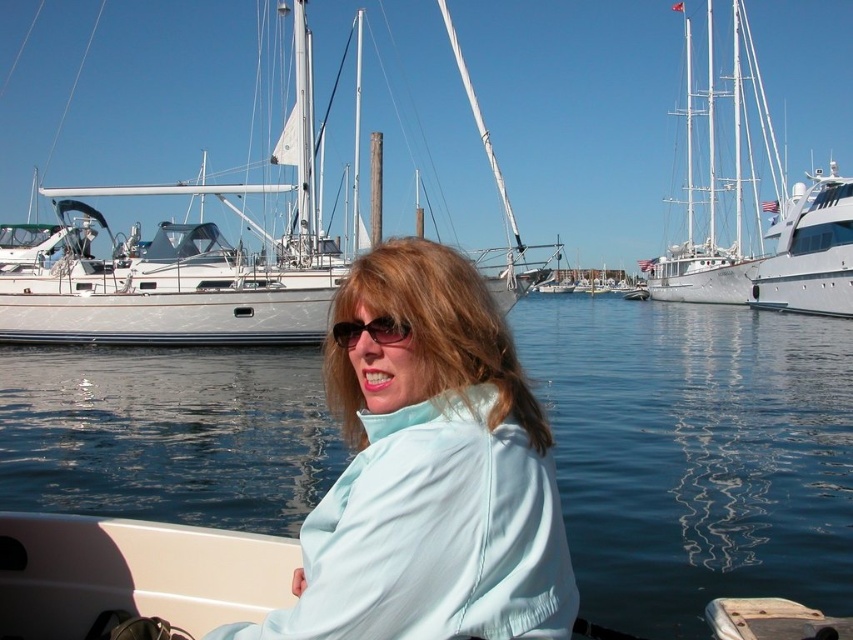
In the scene shown: You are standing at the origin point in the marina scene. There are two points marked in the image. Which point is closer to you, point (0, 330) or point (340, 340)?

Point (340, 340) is closer to you because it is in front of point (0, 330).

You are standing at the edge of the marina and want to reach the point marked as point (294, 316). If your walking speed is 1.5 meters per second, how many seconds will it take you to reach that point?

The distance between you and point (294, 316) is 26.07 meters. At a walking speed of 1.5 meters per second, it will take approximately 17.38 seconds to reach the point.

You are a photographer standing at the edge of the marina. You want to capture a photo where the clear blue water at center and the white glossy sailboat at upper center are both visible. Based on their positions, which object will appear closer to the camera in the photo?

The clear blue water at center appears closer to the camera because it is positioned in front of the white glossy sailboat at upper center in the scene.